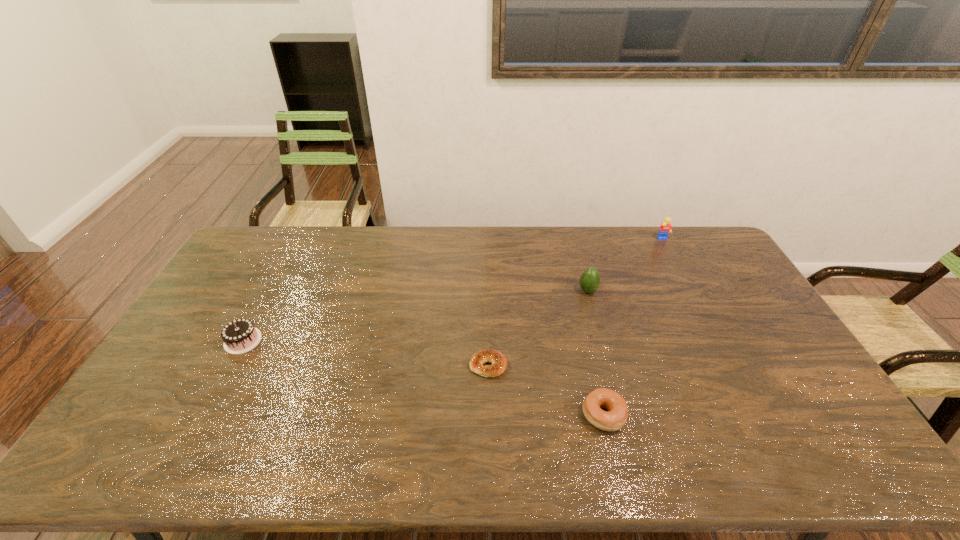
The image size is (960, 540). What are the coordinates of `blank area located on the front of the leftmost object` in the screenshot? It's located at (217, 389).

Find the location of a particular element. The image size is (960, 540). free location located 0.090m on the right of the fourth tallest object is located at coordinates (660, 415).

At what (x,y) coordinates should I click in order to perform the action: click on vacant space located 0.200m on the right of the second object from left to right. Please return your answer as a coordinate pair (x, y). Looking at the image, I should click on (577, 366).

Locate an element on the screen. The height and width of the screenshot is (540, 960). object that is at the far edge is located at coordinates pos(665,228).

Where is `object that is at the left edge`? object that is at the left edge is located at coordinates (239, 336).

Locate an element on the screen. vacant space at the far edge of the desktop is located at coordinates (594, 264).

What are the coordinates of `free space at the near edge of the desktop` in the screenshot? It's located at (624, 467).

The image size is (960, 540). Find the location of `vacant space at the left edge of the desktop`. vacant space at the left edge of the desktop is located at coordinates (223, 295).

This screenshot has height=540, width=960. In the image, there is a desktop. In order to click on vacant space at the far left corner in this screenshot , I will do `click(234, 260)`.

Image resolution: width=960 pixels, height=540 pixels. Find the location of `free region at the far right corner of the desktop`. free region at the far right corner of the desktop is located at coordinates (713, 235).